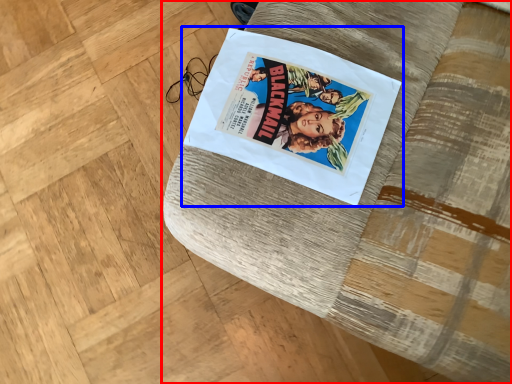
Question: Among these objects, which one is farthest to the camera, furniture (highlighted by a red box) or paperback book (highlighted by a blue box)?

Choices:
 (A) furniture
 (B) paperback book

Answer: (B)